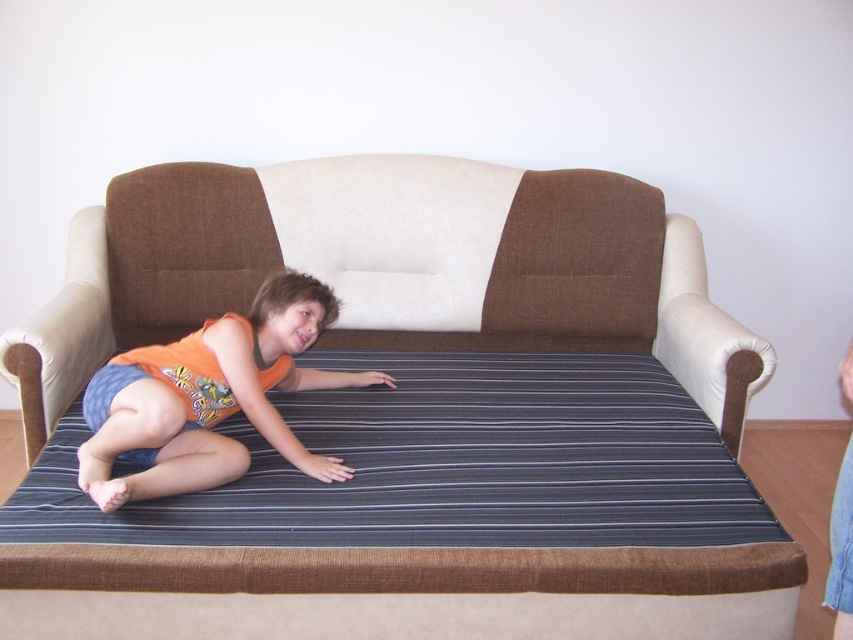
You are a photographer setting up for a portrait. You need to place a small lamp exactly at the position marked by the point (410, 417). According to the scene, where should you place the lamp?

The point (410, 417) marks the brown fabric couch at center, so you should place the lamp on the brown fabric couch at center.

A child is lying on the brown fabric couch at center wearing the orange cotton tank top at center. If the child wants to place a small toy on the floor between them and the couch, would there be enough space? The toy requires 12 inches of space to fit comfortably.

The brown fabric couch at center and orange cotton tank top at center are 11.48 inches apart. Since the required space is 12 inches, there isn not enough space to place the toy comfortably.